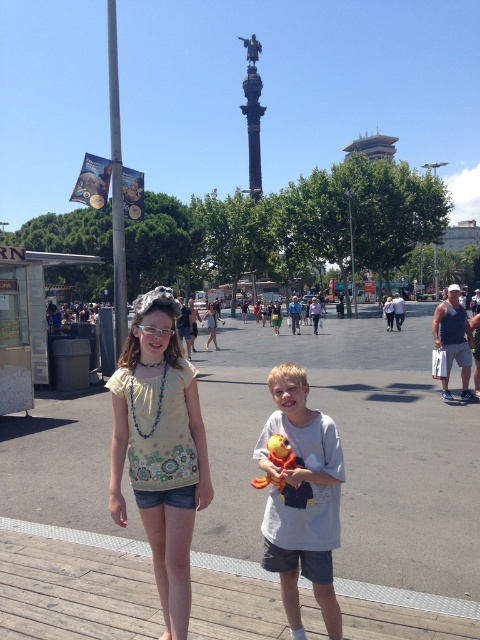
Question: Does light yellow cotton shirt at center lie behind matte yellow blouse at center?

Choices:
 (A) no
 (B) yes

Answer: (A)

Question: Is wooden at center to the right of matte yellow blouse at center from the viewer's perspective?

Choices:
 (A) no
 (B) yes

Answer: (B)

Question: Which point is farther to the camera?

Choices:
 (A) (448, 480)
 (B) (296, 461)

Answer: (A)

Question: Which of the following is the closest to the observer?

Choices:
 (A) matte yellow blouse at center
 (B) matte black dress at center
 (C) light yellow cotton shirt at center
 (D) orange plush toy at center

Answer: (D)

Question: Among these points, which one is nearest to the camera?

Choices:
 (A) (287, 442)
 (B) (358, 506)

Answer: (A)

Question: Does light yellow cotton shirt at center appear over matte yellow blouse at center?

Choices:
 (A) yes
 (B) no

Answer: (B)